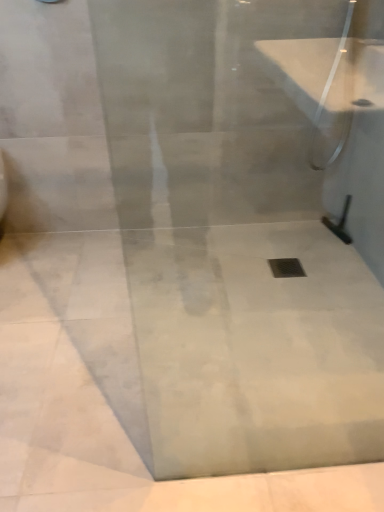
You are a GUI agent. You are given a task and a screenshot of the screen. Output one action in this format:
    pyautogui.click(x=<x>, y=<y>)
    Task: Click on the unoccupied area in front of black rubber squeegee at right, marked as the 2th shower in a top-to-bottom arrangement
    
    Given the screenshot: What is the action you would take?
    pyautogui.click(x=339, y=254)